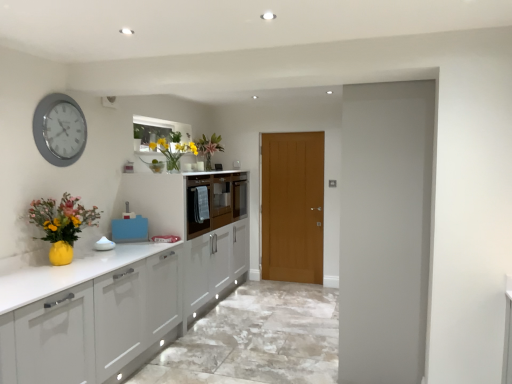
What do you see at coordinates (62, 224) in the screenshot?
I see `matte yellow vase at lower left, the first floral arrangement in the front-to-back sequence` at bounding box center [62, 224].

In order to face matte yellow vase at lower left, the first floral arrangement in the front-to-back sequence, should I rotate leftwards or rightwards?

You should rotate left by 24.198 degrees.

This screenshot has width=512, height=384. What do you see at coordinates (129, 227) in the screenshot?
I see `blue plastic container at center` at bounding box center [129, 227].

Measure the distance between point (202, 227) and camera.

Point (202, 227) is 4.27 meters from camera.

Describe the element at coordinates (186, 200) in the screenshot. I see `matte white cabinetry at center` at that location.

Find the location of a particular element. translucent glass vase at upper center, positioned as the 3th floral arrangement in bottom-to-top order is located at coordinates (209, 148).

From a real-world perspective, which object rests below the other?

From a 3D spatial view, matte white cabinetry at center is below.

Would you say translucent glass vase at upper center, acting as the second floral arrangement starting from the left, is inside or outside matte white cabinetry at center?

translucent glass vase at upper center, acting as the second floral arrangement starting from the left, exists outside the volume of matte white cabinetry at center.

In the image, is translucent glass vase at upper center, the second floral arrangement from the front, on the left side or the right side of matte white cabinetry at center?

translucent glass vase at upper center, the second floral arrangement from the front, is to the left of matte white cabinetry at center.

Consider the image. Is the position of translucent glass vase at upper center, which appears as the second floral arrangement when viewed from the right, more distant than that of matte white cabinetry at center?

No.

Where is `floral arrangement that is the 2nd one when counting downward from the translucent glass vase at upper center, positioned as the 3th floral arrangement in bottom-to-top order (from the image's perspective)`? floral arrangement that is the 2nd one when counting downward from the translucent glass vase at upper center, positioned as the 3th floral arrangement in bottom-to-top order (from the image's perspective) is located at coordinates (62, 224).

Which of these two, matte yellow vase at lower left, which is counted as the first floral arrangement, starting from the left, or translucent glass vase at upper center, the 3th floral arrangement viewed from the left, stands taller?

matte yellow vase at lower left, which is counted as the first floral arrangement, starting from the left, is taller.

From a real-world perspective, between matte yellow vase at lower left, the third floral arrangement positioned from the top, and translucent glass vase at upper center, which is counted as the 1th floral arrangement, starting from the back, who is vertically lower?

From a 3D spatial view, matte yellow vase at lower left, the third floral arrangement positioned from the top, is below.

Which object is more forward, matte yellow vase at lower left, the first floral arrangement in the front-to-back sequence, or translucent glass vase at upper center, placed as the third floral arrangement when sorted from front to back?

matte yellow vase at lower left, the first floral arrangement in the front-to-back sequence.

Is matte yellow vase at lower left, placed as the first floral arrangement when sorted from bottom to top, inside matte wood door at center?

No, matte yellow vase at lower left, placed as the first floral arrangement when sorted from bottom to top, is not surrounded by matte wood door at center.

Is matte wood door at center at the left side of matte yellow vase at lower left, placed as the first floral arrangement when sorted from bottom to top?

No, matte wood door at center is not to the left of matte yellow vase at lower left, placed as the first floral arrangement when sorted from bottom to top.

What's the angular difference between matte wood door at center and matte yellow vase at lower left, the third floral arrangement positioned from the top,'s facing directions?

91.2 degrees separate the facing orientations of matte wood door at center and matte yellow vase at lower left, the third floral arrangement positioned from the top.

Is matte wood door at center taller than matte yellow vase at lower left, placed as the first floral arrangement when sorted from bottom to top?

Yes, matte wood door at center is taller than matte yellow vase at lower left, placed as the first floral arrangement when sorted from bottom to top.

Who is bigger, translucent glass vase at upper center, the 3th floral arrangement viewed from the left, or matte wood door at center?

With larger size is matte wood door at center.

Considering the relative sizes of translucent glass vase at upper center, positioned as the 3th floral arrangement in bottom-to-top order, and matte wood door at center in the image provided, is translucent glass vase at upper center, positioned as the 3th floral arrangement in bottom-to-top order, shorter than matte wood door at center?

Yes.

From the image's perspective, relative to matte wood door at center, is translucent glass vase at upper center, which is the first floral arrangement in right-to-left order, above or below?

Based on their image positions, translucent glass vase at upper center, which is the first floral arrangement in right-to-left order, is located above matte wood door at center.

Considering the sizes of objects translucent glass vase at upper center, the 3th floral arrangement viewed from the left, and translucent glass vase at upper center, which appears as the second floral arrangement when viewed from the right, in the image provided, who is smaller, translucent glass vase at upper center, the 3th floral arrangement viewed from the left, or translucent glass vase at upper center, which appears as the second floral arrangement when viewed from the right,?

translucent glass vase at upper center, which appears as the second floral arrangement when viewed from the right, is smaller.

Between translucent glass vase at upper center, which is counted as the 1th floral arrangement, starting from the back, and translucent glass vase at upper center, which appears as the second floral arrangement when viewed from the right, which one has smaller width?

With smaller width is translucent glass vase at upper center, which is counted as the 1th floral arrangement, starting from the back.

From a real-world perspective, between translucent glass vase at upper center, positioned as the 3th floral arrangement in bottom-to-top order, and translucent glass vase at upper center, acting as the second floral arrangement starting from the left, who is vertically higher?

From a 3D spatial view, translucent glass vase at upper center, positioned as the 3th floral arrangement in bottom-to-top order, is above.

Considering the points (205, 148) and (170, 155), which point is in front, point (205, 148) or point (170, 155)?

The point (170, 155) is in front.

From the picture: Is matte wood door at center thinner than translucent glass vase at upper center, acting as the second floral arrangement starting from the left?

Indeed, matte wood door at center has a lesser width compared to translucent glass vase at upper center, acting as the second floral arrangement starting from the left.

Relative to translucent glass vase at upper center, the 2th floral arrangement positioned from the back, is matte wood door at center in front or behind?

Clearly, matte wood door at center is behind translucent glass vase at upper center, the 2th floral arrangement positioned from the back.

Could you tell me if matte wood door at center is facing translucent glass vase at upper center, the second floral arrangement from the front?

Yes, matte wood door at center faces towards translucent glass vase at upper center, the second floral arrangement from the front.

How far apart are matte wood door at center and translucent glass vase at upper center, the second floral arrangement from the front?

They are 6.77 feet apart.

Between blue plastic container at center and translucent glass vase at upper center, the second floral arrangement from the bottom, which one is positioned in front?

translucent glass vase at upper center, the second floral arrangement from the bottom, is in front.

Consider the image. Is blue plastic container at center not close to translucent glass vase at upper center, which appears as the second floral arrangement when viewed from the right?

That's not correct — blue plastic container at center is a little close to translucent glass vase at upper center, which appears as the second floral arrangement when viewed from the right.

Does blue plastic container at center appear on the left side of translucent glass vase at upper center, the 2th floral arrangement positioned from the back?

Indeed, blue plastic container at center is positioned on the left side of translucent glass vase at upper center, the 2th floral arrangement positioned from the back.

Locate an element on the screen. This screenshot has width=512, height=384. cabinetry below the translucent glass vase at upper center, which appears as the second floral arrangement when viewed from the right (from a real-world perspective) is located at coordinates (186, 200).

I want to click on the 2nd floral arrangement behind when counting from the matte yellow vase at lower left, the third floral arrangement when ordered from back to front, so click(x=209, y=148).

Considering their positions, is matte white cabinetry at center positioned further to matte wood door at center than translucent glass vase at upper center, positioned as the second floral arrangement in top-to-bottom order?

translucent glass vase at upper center, positioned as the second floral arrangement in top-to-bottom order.

Based on their spatial positions, is matte wood door at center or translucent glass vase at upper center, the 2th floral arrangement positioned from the back, closer to silver metallic clock at upper left?

translucent glass vase at upper center, the 2th floral arrangement positioned from the back, is positioned closer to the anchor silver metallic clock at upper left.

Based on their spatial positions, is matte wood door at center or blue plastic container at center further from silver metallic clock at upper left?

matte wood door at center.

When comparing their distances from matte yellow vase at lower left, the third floral arrangement when ordered from back to front, does translucent glass vase at upper center, the 2th floral arrangement positioned from the back, or matte white cabinetry at center seem closer?

translucent glass vase at upper center, the 2th floral arrangement positioned from the back, is positioned closer to the anchor matte yellow vase at lower left, the third floral arrangement when ordered from back to front.

Considering their positions, is silver metallic clock at upper left positioned further to blue plastic container at center than matte wood door at center?

The object further to blue plastic container at center is matte wood door at center.

Estimate the real-world distances between objects in this image. Which object is closer to translucent glass vase at upper center, which is counted as the 1th floral arrangement, starting from the back, translucent glass vase at upper center, acting as the second floral arrangement starting from the left, or blue plastic container at center?

translucent glass vase at upper center, acting as the second floral arrangement starting from the left.

Which object lies nearer to the anchor point matte white cabinetry at center, silver metallic clock at upper left or translucent glass vase at upper center, which is counted as the 1th floral arrangement, starting from the back?

translucent glass vase at upper center, which is counted as the 1th floral arrangement, starting from the back, lies closer to matte white cabinetry at center than the other object.

Looking at the image, which one is located further to matte wood door at center, matte yellow vase at lower left, the first floral arrangement in the front-to-back sequence, or translucent glass vase at upper center, the second floral arrangement from the front?

Among the two, matte yellow vase at lower left, the first floral arrangement in the front-to-back sequence, is located further to matte wood door at center.

Find the location of a particular element. The height and width of the screenshot is (384, 512). floral arrangement between matte yellow vase at lower left, the third floral arrangement when ordered from back to front, and matte white cabinetry at center, along the z-axis is located at coordinates (173, 152).

Where is `clock between matte yellow vase at lower left, the 3th floral arrangement in the right-to-left sequence, and blue plastic container at center from front to back`? This screenshot has height=384, width=512. clock between matte yellow vase at lower left, the 3th floral arrangement in the right-to-left sequence, and blue plastic container at center from front to back is located at coordinates (59, 129).

Find the location of a particular element. appliance between silver metallic clock at upper left and matte white cabinetry at center along the z-axis is located at coordinates (129, 227).

What are the coordinates of `cabinetry between matte yellow vase at lower left, which is counted as the first floral arrangement, starting from the left, and matte wood door at center in the front-back direction` in the screenshot? It's located at (186, 200).